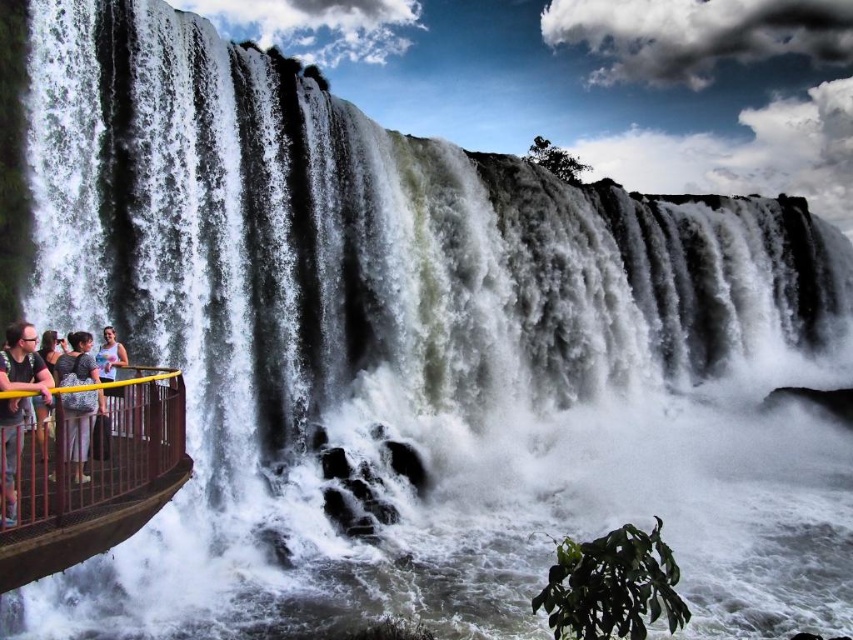
You are standing at the center of the viewing platform and want to take a photo of the waterfall without any people in the frame. The only person blocking your view is the one wearing the matte black shirt at left. Where should you move to avoid them?

Move to the right side of the viewing platform away from the matte black shirt at left, as the person is located at point (22, 362) which is on the left side. By moving right, you can position yourself to have a clear view of the waterfall without the person obstructing the shot.

You are a tourist standing on the viewing platform near the yellow metal railing at lower left and the matte black shirt at left. You want to take a photo of the waterfall without any obstructions. Which object should you move away from to avoid blocking your view?

The yellow metal railing at lower left is taller than the matte black shirt at left. To avoid blocking your view, you should move away from the yellow metal railing at lower left since it is taller and could obstruct your photo.